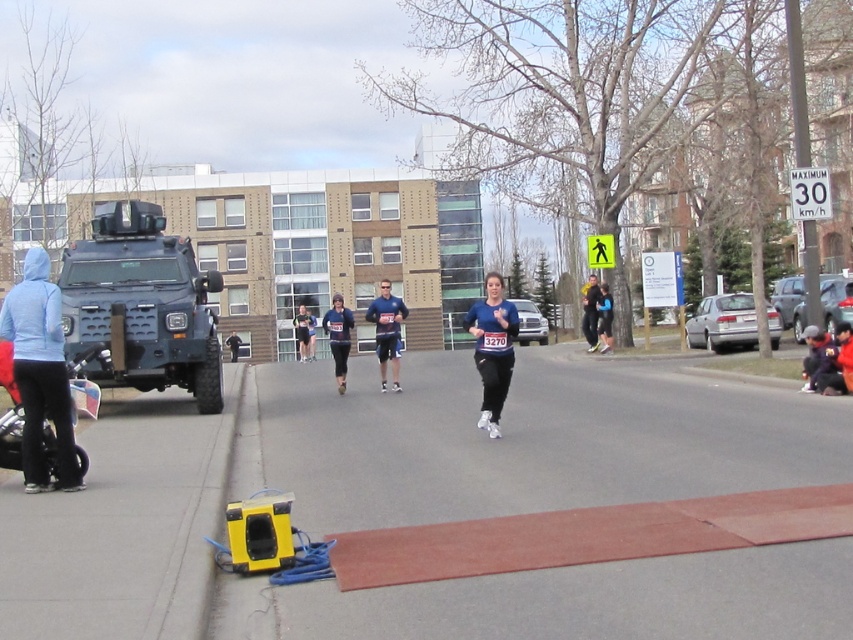
Can you confirm if yellow rubber mat at lower left is shorter than blue fabric running suit at center?

Yes.

Looking at this image, between yellow rubber mat at lower left and blue fabric running suit at center, which one has more height?

blue fabric running suit at center

Describe the element at coordinates (531, 442) in the screenshot. I see `yellow rubber mat at lower left` at that location.

Where is `yellow rubber mat at lower left`? Image resolution: width=853 pixels, height=640 pixels. yellow rubber mat at lower left is located at coordinates (531, 442).

Does matte blue shirt at center come behind blue fabric running suit at center?

No, matte blue shirt at center is in front of blue fabric running suit at center.

Can you confirm if matte blue shirt at center is thinner than blue fabric running suit at center?

No.

What do you see at coordinates (387, 332) in the screenshot? I see `matte blue shirt at center` at bounding box center [387, 332].

Image resolution: width=853 pixels, height=640 pixels. I want to click on matte blue shirt at center, so click(x=387, y=332).

Is yellow plastic at lower left shorter than dark blue jacket at center?

Correct, yellow plastic at lower left is not as tall as dark blue jacket at center.

Which is more to the right, yellow plastic at lower left or dark blue jacket at center?

dark blue jacket at center is more to the right.

Identify the location of yellow plastic at lower left. (122, 528).